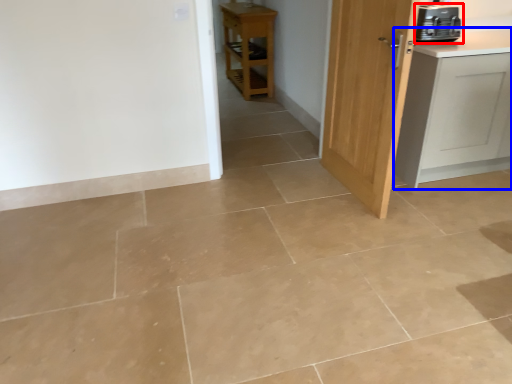
Question: Which of the following is the farthest to the observer, home appliance (highlighted by a red box) or cabinetry (highlighted by a blue box)?

Choices:
 (A) home appliance
 (B) cabinetry

Answer: (A)